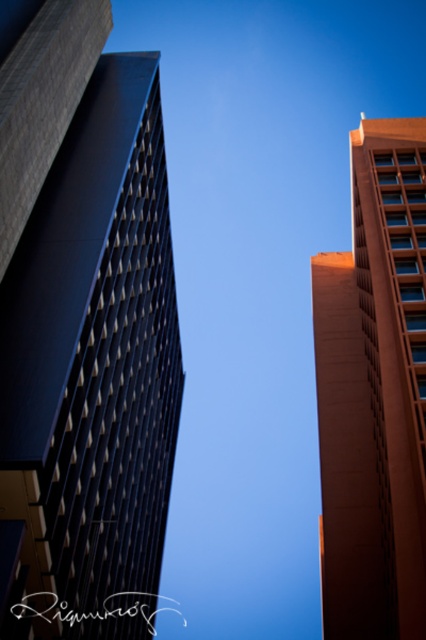
Question: Is matte black building at left thinner than orange smooth building at upper right?

Choices:
 (A) yes
 (B) no

Answer: (A)

Question: Which object is farther from the camera taking this photo?

Choices:
 (A) orange smooth building at upper right
 (B) matte black building at left

Answer: (A)

Question: Does matte black building at left appear over orange smooth building at upper right?

Choices:
 (A) yes
 (B) no

Answer: (B)

Question: Is matte black building at left closer to the viewer compared to orange smooth building at upper right?

Choices:
 (A) yes
 (B) no

Answer: (A)